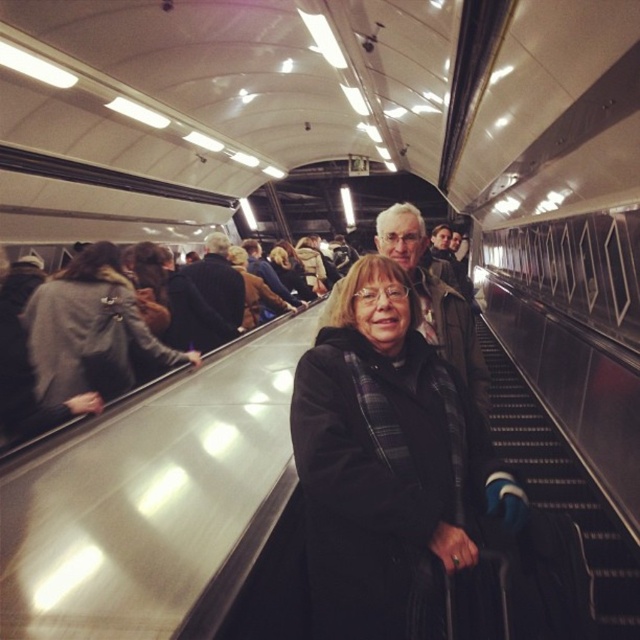
Question: Which of the following is the farthest from the observer?

Choices:
 (A) (205, 275)
 (B) (106, 316)
 (C) (275, 294)
 (D) (308, 285)

Answer: (D)

Question: Does black wool coat at center appear over gray wool coat at left?

Choices:
 (A) yes
 (B) no

Answer: (B)

Question: Is dark brown leather jacket at center above plaid wool coat at center?

Choices:
 (A) yes
 (B) no

Answer: (B)

Question: Which point is closer to the camera taking this photo?

Choices:
 (A) (205, 298)
 (B) (285, 278)
 (C) (451, 364)
 (D) (289, 305)

Answer: (C)

Question: Is gray wool coat at left closer to camera compared to matte black coat at center?

Choices:
 (A) yes
 (B) no

Answer: (A)

Question: Which object appears farthest from the camera in this image?

Choices:
 (A) matte brown coat at center
 (B) black metal stairs at lower right
 (C) gray wool coat at left

Answer: (C)